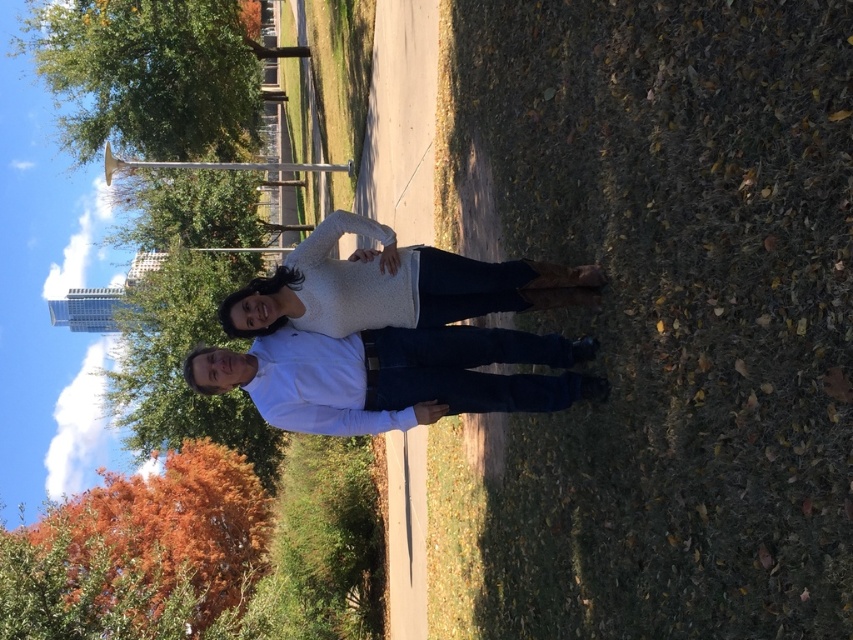
Question: Does white cotton shirt at center have a smaller size compared to white knit sweater at center?

Choices:
 (A) yes
 (B) no

Answer: (A)

Question: Can you confirm if white cotton shirt at center is positioned above white knit sweater at center?

Choices:
 (A) no
 (B) yes

Answer: (A)

Question: Which of the following is the farthest from the observer?

Choices:
 (A) white knit sweater at center
 (B) white cotton shirt at center

Answer: (A)

Question: Can you confirm if white cotton shirt at center is bigger than white knit sweater at center?

Choices:
 (A) no
 (B) yes

Answer: (A)